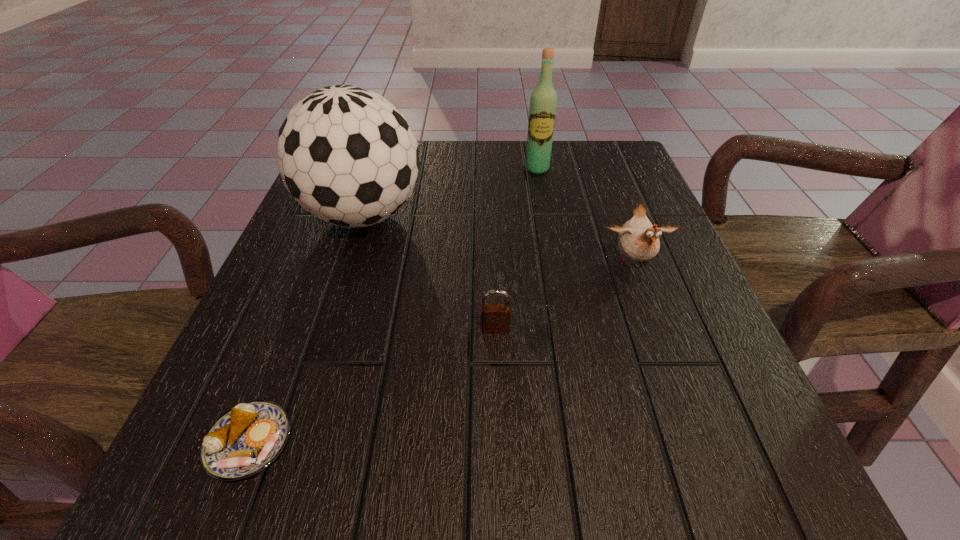
I want to click on object located at the far left corner, so click(347, 155).

You are a GUI agent. You are given a task and a screenshot of the screen. Output one action in this format:
    pyautogui.click(x=<x>, y=<y>)
    Task: Click on the object that is at the near left corner
    
    Given the screenshot: What is the action you would take?
    pyautogui.click(x=245, y=440)

Where is `vacant space at the far edge of the desktop`? vacant space at the far edge of the desktop is located at coordinates 574,175.

This screenshot has height=540, width=960. What are the coordinates of `vacant space at the near edge` in the screenshot? It's located at (551, 488).

Where is `vacant space at the left edge`? The image size is (960, 540). vacant space at the left edge is located at coordinates (317, 258).

This screenshot has width=960, height=540. Find the location of `free location at the right edge`. free location at the right edge is located at coordinates (662, 355).

In the image, there is a desktop. Identify the location of vacant space at the far right corner. (579, 164).

At what (x,y) coordinates should I click in order to perform the action: click on vacant space that is in between the soccer ball and the wine bottle. Please return your answer as a coordinate pair (x, y). The width and height of the screenshot is (960, 540). Looking at the image, I should click on (450, 192).

This screenshot has height=540, width=960. Find the location of `empty location between the padlock and the third shortest object`. empty location between the padlock and the third shortest object is located at coordinates (564, 296).

Image resolution: width=960 pixels, height=540 pixels. I want to click on vacant region between the fourth tallest object and the nearest object, so click(372, 386).